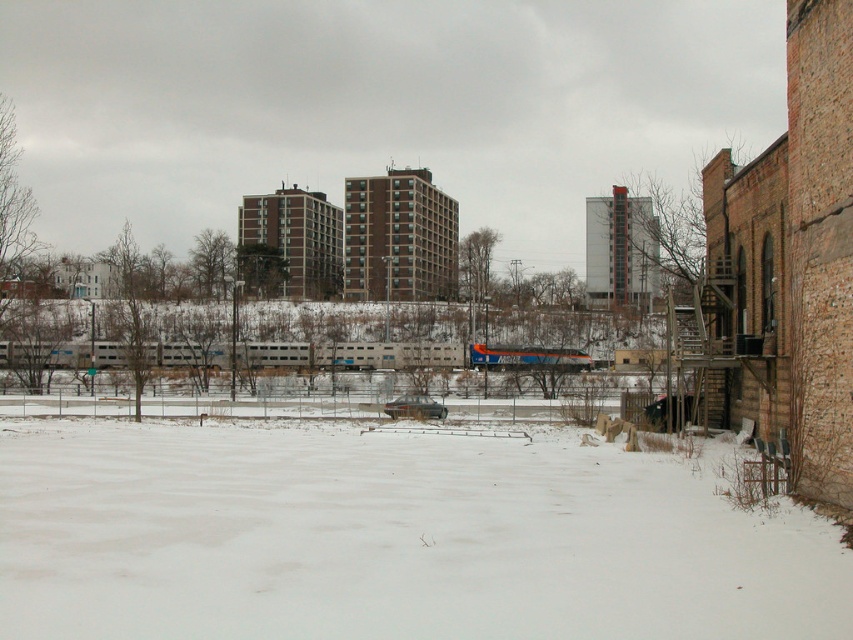
Is the position of white powdery snow at lower center more distant than that of silver metallic train at center?

No, white powdery snow at lower center is closer to the viewer.

Consider the image. Does white powdery snow at lower center have a greater height compared to silver metallic train at center?

In fact, white powdery snow at lower center may be shorter than silver metallic train at center.

Locate an element on the screen. This screenshot has height=640, width=853. white powdery snow at lower center is located at coordinates (393, 538).

Is silver metallic train at center positioned at the back of orange metallic train at center?

No, it is in front of orange metallic train at center.

Is silver metallic train at center above orange metallic train at center?

Yes.

Which is in front, point (3, 364) or point (541, 355)?

Point (3, 364) is more forward.

Locate an element on the screen. The image size is (853, 640). silver metallic train at center is located at coordinates tap(401, 355).

Between white powdery snow at lower center and orange metallic train at center, which one is positioned higher?

Positioned higher is orange metallic train at center.

Is white powdery snow at lower center in front of orange metallic train at center?

Yes, white powdery snow at lower center is in front of orange metallic train at center.

Does point (685, 483) come closer to viewer compared to point (517, 365)?

Yes, point (685, 483) is closer to viewer.

At what (x,y) coordinates should I click in order to perform the action: click on white powdery snow at lower center. Please return your answer as a coordinate pair (x, y). The width and height of the screenshot is (853, 640). Looking at the image, I should click on (393, 538).